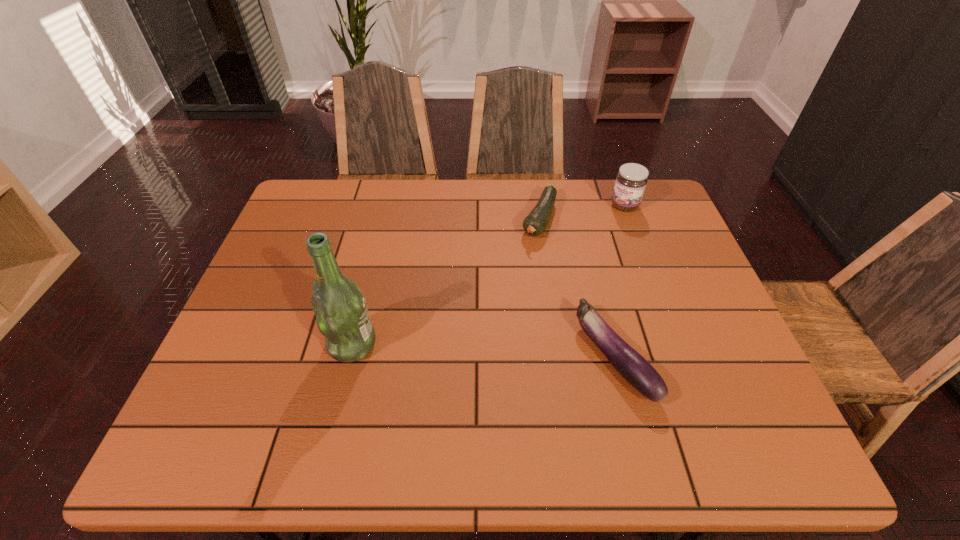
Where is `blank space located at the blossom end of the zucchini`? blank space located at the blossom end of the zucchini is located at coordinates (491, 320).

Identify the location of vacant point located 0.160m at the blossom end of the zucchini. The image size is (960, 540). (513, 281).

Locate an element on the screen. The height and width of the screenshot is (540, 960). vacant space located at the blossom end of the zucchini is located at coordinates (478, 342).

Locate an element on the screen. free space located on the front label of the jam is located at coordinates (580, 267).

At what (x,y) coordinates should I click in order to perform the action: click on vacant space situated 0.330m on the front label of the jam. Please return your answer as a coordinate pair (x, y). Looking at the image, I should click on (571, 278).

The image size is (960, 540). What are the coordinates of `vacant space located 0.220m on the front label of the jam` in the screenshot? It's located at (588, 254).

Identify the location of zucchini at the far edge. This screenshot has height=540, width=960. (535, 223).

Identify the location of jam that is at the far edge. (631, 180).

At what (x,y) coordinates should I click in order to perform the action: click on object that is at the near edge. Please return your answer as a coordinate pair (x, y). The image size is (960, 540). Looking at the image, I should click on (634, 368).

Find the location of a particular element. object located at the right edge is located at coordinates (631, 180).